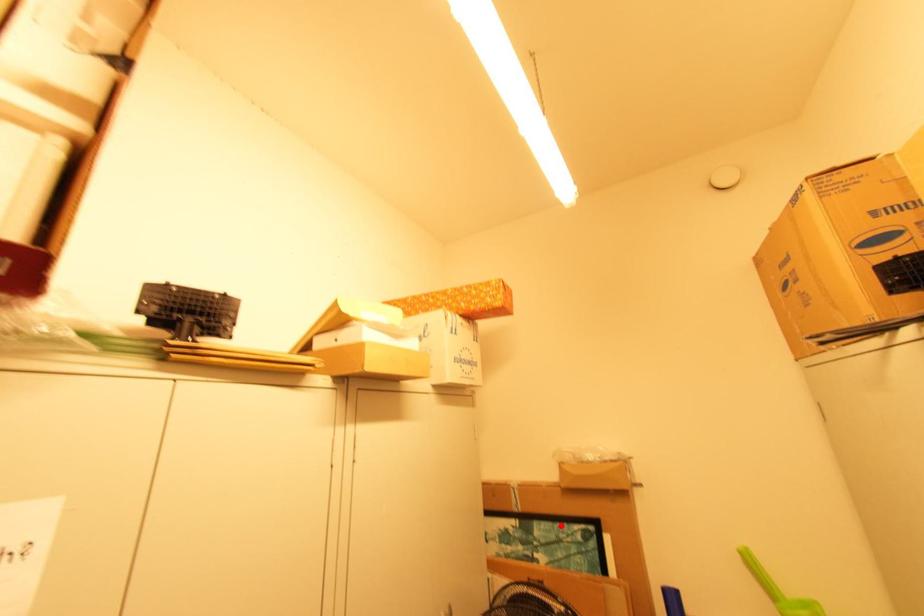
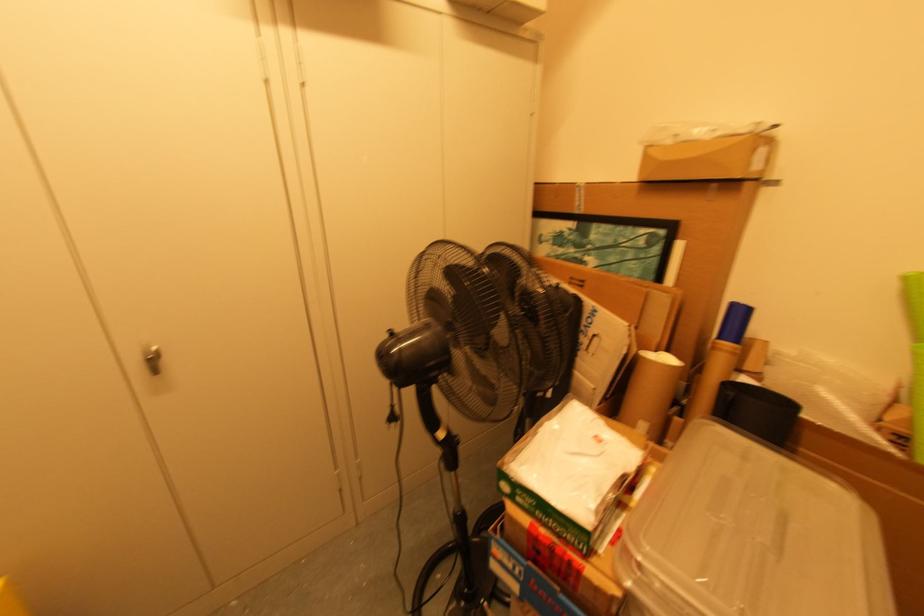
The point at the highlighted location is marked in the first image. Where is the corresponding point in the second image?

(622, 228)